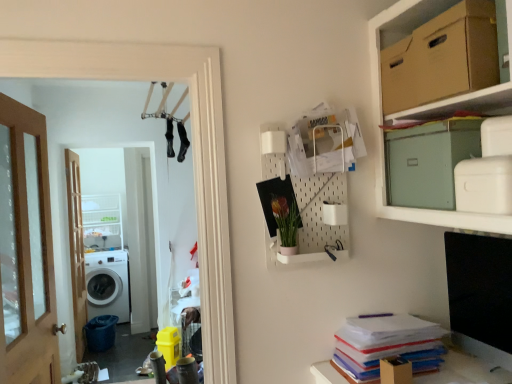
Question: From the image's perspective, is wooden door at left, placed as the 1th door when sorted from front to back, located beneath matte green cardboard box at upper right, which is the second cardboard box from top to bottom?

Choices:
 (A) no
 (B) yes

Answer: (B)

Question: Is wooden door at left, placed as the 1th door when sorted from front to back, completely or partially outside of matte green cardboard box at upper right, which is the second cardboard box from top to bottom?

Choices:
 (A) no
 (B) yes

Answer: (B)

Question: Can you confirm if wooden door at left, the 2th door when ordered from left to right, is bigger than matte green cardboard box at upper right, which is the second cardboard box from top to bottom?

Choices:
 (A) no
 (B) yes

Answer: (B)

Question: Considering the relative sizes of wooden door at left, the 2th door when ordered from left to right, and matte green cardboard box at upper right, which is counted as the 1th cardboard box, starting from the bottom, in the image provided, is wooden door at left, the 2th door when ordered from left to right, shorter than matte green cardboard box at upper right, which is counted as the 1th cardboard box, starting from the bottom,?

Choices:
 (A) yes
 (B) no

Answer: (B)

Question: Does wooden door at left, the second door viewed from the back, have a greater width compared to matte green cardboard box at upper right, which is the second cardboard box from top to bottom?

Choices:
 (A) yes
 (B) no

Answer: (B)

Question: Considering the positions of green matte plant at upper center and brown cardboard box at upper right, arranged as the 2th cardboard box when ordered from the bottom, in the image, is green matte plant at upper center taller or shorter than brown cardboard box at upper right, arranged as the 2th cardboard box when ordered from the bottom,?

Choices:
 (A) tall
 (B) short

Answer: (B)

Question: Considering the positions of green matte plant at upper center and brown cardboard box at upper right, positioned as the 1th cardboard box in top-to-bottom order, in the image, is green matte plant at upper center bigger or smaller than brown cardboard box at upper right, positioned as the 1th cardboard box in top-to-bottom order,?

Choices:
 (A) small
 (B) big

Answer: (A)

Question: Considering the relative positions of green matte plant at upper center and brown cardboard box at upper right, arranged as the 2th cardboard box when ordered from the bottom, in the image provided, is green matte plant at upper center to the left or to the right of brown cardboard box at upper right, arranged as the 2th cardboard box when ordered from the bottom,?

Choices:
 (A) left
 (B) right

Answer: (A)

Question: Is green matte plant at upper center inside or outside of brown cardboard box at upper right, positioned as the 1th cardboard box in top-to-bottom order?

Choices:
 (A) inside
 (B) outside

Answer: (B)

Question: Considering their positions, is white glossy washing machine at left located in front of or behind brown wooden door at left, placed as the 2th door when sorted from front to back?

Choices:
 (A) front
 (B) behind

Answer: (B)

Question: Is white glossy washing machine at left to the left or to the right of brown wooden door at left, positioned as the first door in left-to-right order, in the image?

Choices:
 (A) right
 (B) left

Answer: (B)

Question: From their relative heights in the image, would you say white glossy washing machine at left is taller or shorter than brown wooden door at left, positioned as the first door in left-to-right order?

Choices:
 (A) tall
 (B) short

Answer: (B)

Question: From the image's perspective, is white glossy washing machine at left above or below brown wooden door at left, positioned as the first door in left-to-right order?

Choices:
 (A) above
 (B) below

Answer: (B)

Question: Is white plastic cabinet at left bigger or smaller than white glossy laundry machine at left?

Choices:
 (A) big
 (B) small

Answer: (A)

Question: In terms of width, does white plastic cabinet at left look wider or thinner when compared to white glossy laundry machine at left?

Choices:
 (A) thin
 (B) wide

Answer: (B)